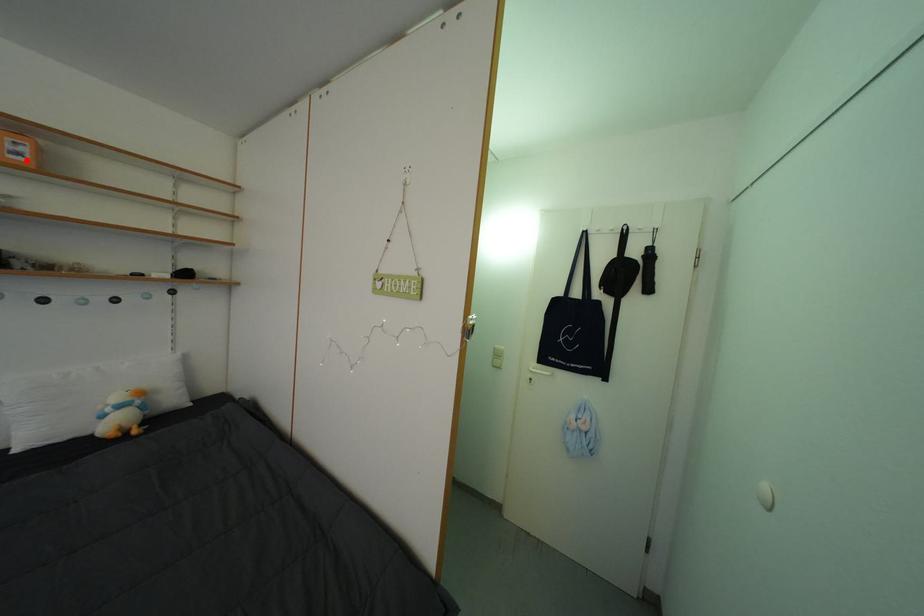
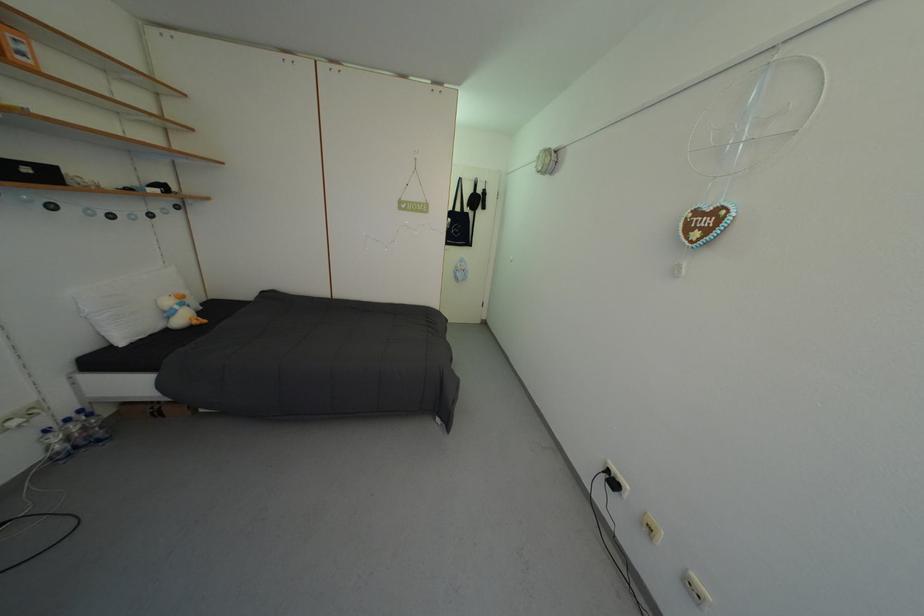
Locate, in the second image, the point that corresponds to the highlighted location in the first image.

(30, 60)